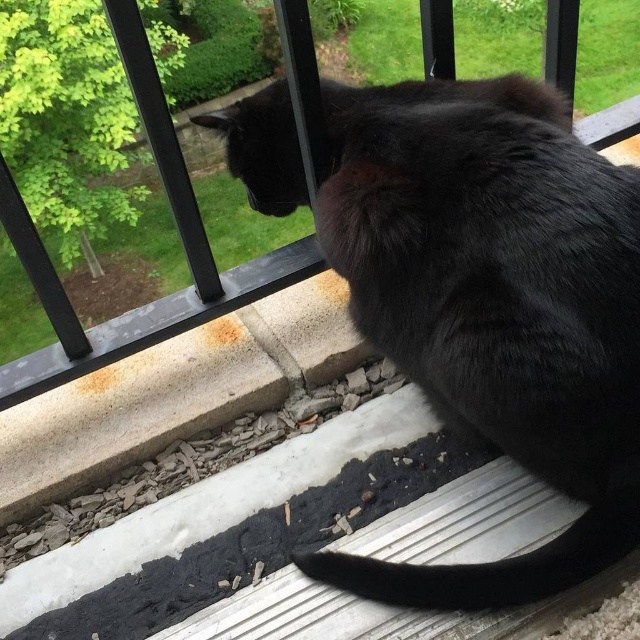
Question: Is the position of black fluffy cat at upper center more distant than that of transparent plastic screen door at upper center?

Choices:
 (A) yes
 (B) no

Answer: (B)

Question: Which point is closer to the camera?

Choices:
 (A) (545, 221)
 (B) (44, 380)

Answer: (A)

Question: Considering the relative positions of black fluffy cat at upper center and transparent plastic screen door at upper center in the image provided, where is black fluffy cat at upper center located with respect to transparent plastic screen door at upper center?

Choices:
 (A) below
 (B) above

Answer: (A)

Question: In this image, where is black fluffy cat at upper center located relative to transparent plastic screen door at upper center?

Choices:
 (A) below
 (B) above

Answer: (A)